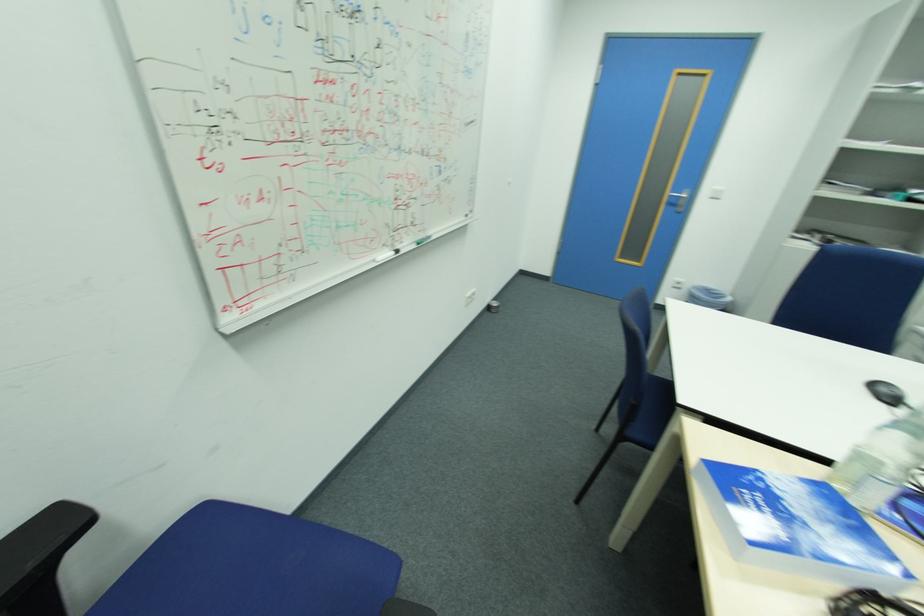
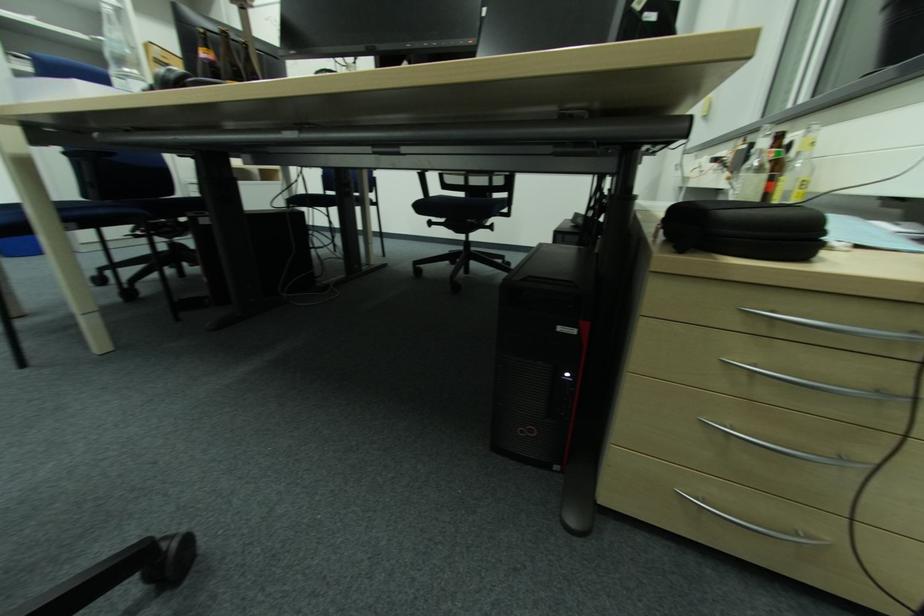
The images are taken continuously from a first-person perspective. In which direction is your viewpoint rotating?

The rotation direction of the camera is right-down.